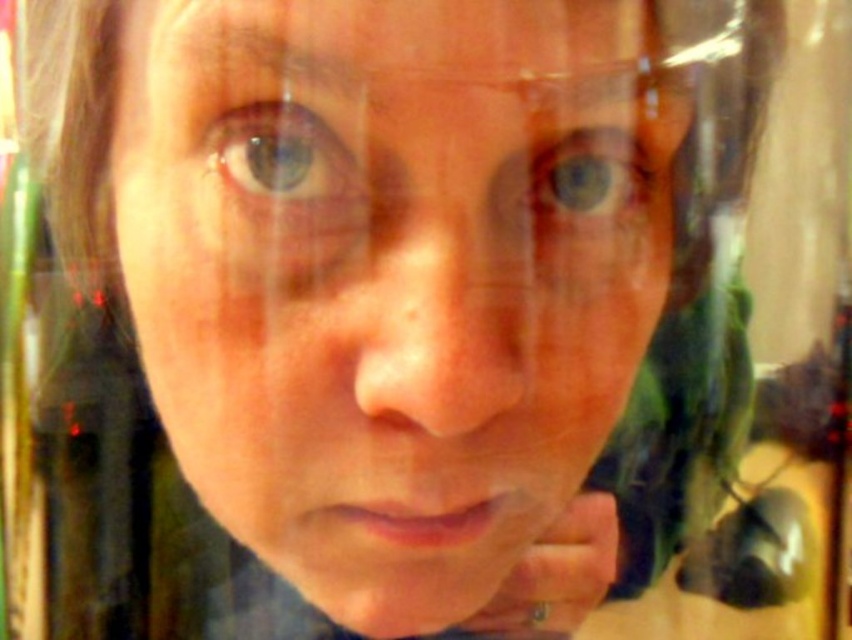
Is smooth skin face at center closer to the viewer compared to blue matte eye at upper center?

Yes, it is.

Which of these two, smooth skin face at center or blue matte eye at upper center, stands shorter?

blue matte eye at upper center is shorter.

The image size is (852, 640). Describe the element at coordinates (390, 289) in the screenshot. I see `smooth skin face at center` at that location.

Find the location of a particular element. Image resolution: width=852 pixels, height=640 pixels. smooth skin face at center is located at coordinates (390, 289).

Does point (268, 410) come behind point (258, 141)?

Yes, point (268, 410) is farther from viewer.

Does point (344, 308) come closer to viewer compared to point (229, 170)?

That is True.

Does point (403, 417) come behind point (349, 166)?

Yes, it is behind point (349, 166).

Find the location of a particular element. The width and height of the screenshot is (852, 640). smooth skin face at center is located at coordinates (390, 289).

Who is shorter, blue glossy eye at upper center or blue matte eye at upper center?

blue glossy eye at upper center

Does point (320, 180) come in front of point (652, 177)?

Yes.

Does point (303, 136) come in front of point (571, 211)?

Yes, it is.

Where is `blue glossy eye at upper center`? The width and height of the screenshot is (852, 640). blue glossy eye at upper center is located at coordinates (285, 160).